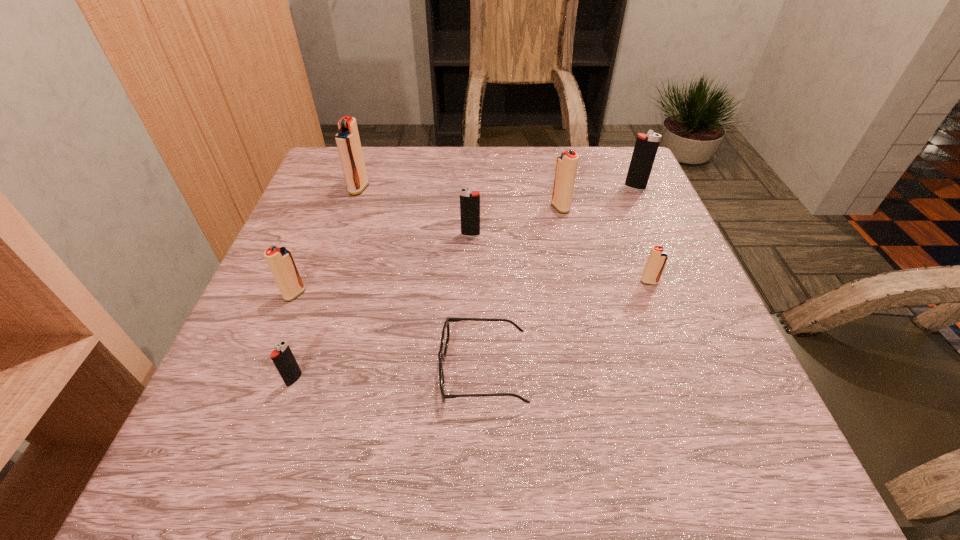
Locate an element on the screen. The image size is (960, 540). the fifth farthest object is located at coordinates (657, 259).

The image size is (960, 540). I want to click on the third nearest igniter, so click(x=657, y=259).

This screenshot has height=540, width=960. What are the coordinates of `the smallest black igniter` in the screenshot? It's located at (283, 358).

The height and width of the screenshot is (540, 960). Find the location of `the nearest igniter`. the nearest igniter is located at coordinates (283, 358).

Find the location of a particular element. This screenshot has height=540, width=960. the shortest object is located at coordinates (445, 335).

Locate an element on the screen. free point located on the front of the tallest object is located at coordinates click(x=344, y=233).

What are the coordinates of `blank area located on the left of the second farthest red igniter` in the screenshot? It's located at (446, 207).

The width and height of the screenshot is (960, 540). Find the location of `free point located on the left of the rightmost igniter`. free point located on the left of the rightmost igniter is located at coordinates (469, 187).

What are the coordinates of `free space located 0.080m on the back of the second black igniter from right to left` in the screenshot? It's located at (471, 210).

At what (x,y) coordinates should I click in order to perform the action: click on vacant space situated 0.160m on the front of the third nearest object. Please return your answer as a coordinate pair (x, y). Looking at the image, I should click on (262, 375).